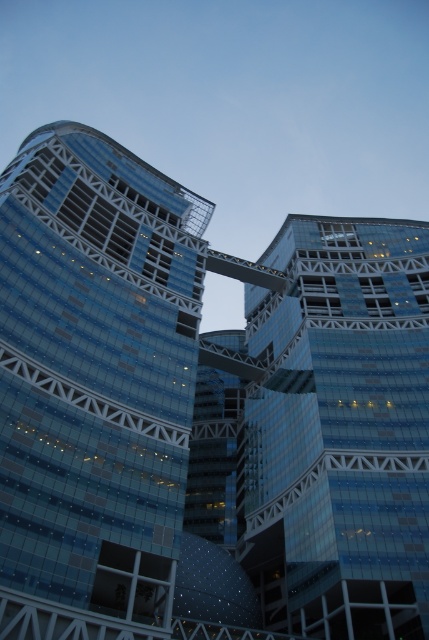
Question: Is transparent glass building at left closer to camera compared to transparent glass building at center?

Choices:
 (A) no
 (B) yes

Answer: (B)

Question: Which of the following is the closest to the observer?

Choices:
 (A) (316, 220)
 (B) (63, 628)

Answer: (B)

Question: From the image, what is the correct spatial relationship of transparent glass building at left in relation to transparent glass building at center?

Choices:
 (A) above
 (B) below

Answer: (A)

Question: Is the position of transparent glass building at left less distant than that of transparent glass building at center?

Choices:
 (A) yes
 (B) no

Answer: (A)